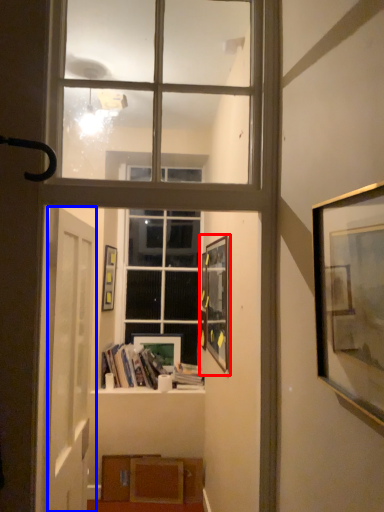
Question: Which object is closer to the camera taking this photo, picture frame (highlighted by a red box) or door (highlighted by a blue box)?

Choices:
 (A) picture frame
 (B) door

Answer: (B)